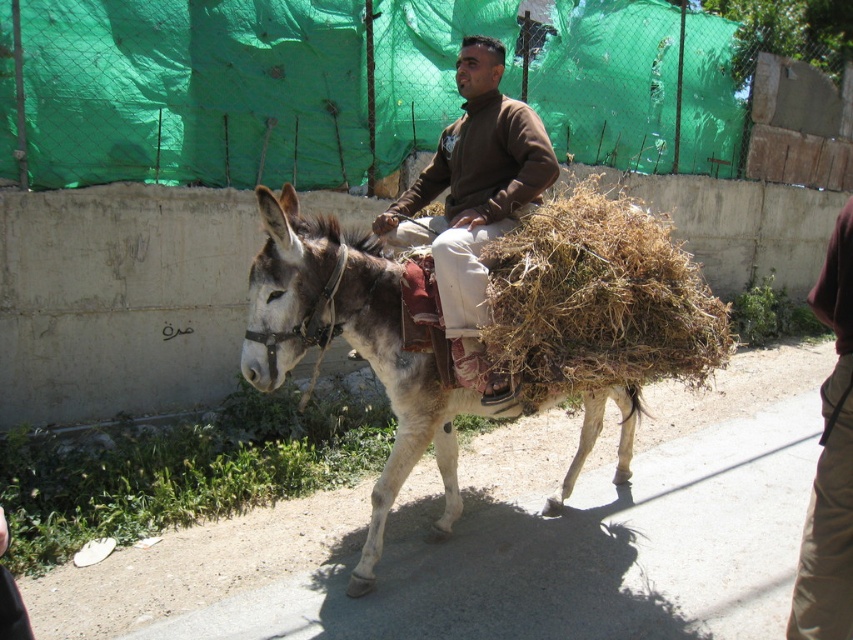
Does brown dry grass at center have a lesser width compared to brown woolen sweater at center?

No.

Which is below, brown dry grass at center or brown woolen sweater at center?

Positioned lower is brown dry grass at center.

Who is more distant from viewer, [618,353] or [498,397]?

Positioned behind is point [498,397].

Identify the location of brown dry grass at center. The image size is (853, 640). (598, 298).

Which is in front, point (416, 376) or point (830, 440)?

Point (830, 440) is more forward.

Which is above, gray matte mule at center or brown cotton pants at lower right?

Positioned higher is gray matte mule at center.

Measure the distance between point (247, 376) and camera.

3.37 meters

Where is `gray matte mule at center`? The image size is (853, 640). gray matte mule at center is located at coordinates (352, 346).

Looking at this image, who is lower down, brown dry grass at center or gray matte mule at center?

gray matte mule at center is lower down.

Who is positioned more to the left, brown dry grass at center or gray matte mule at center?

Positioned to the left is gray matte mule at center.

The image size is (853, 640). In order to click on brown dry grass at center in this screenshot , I will do `click(598, 298)`.